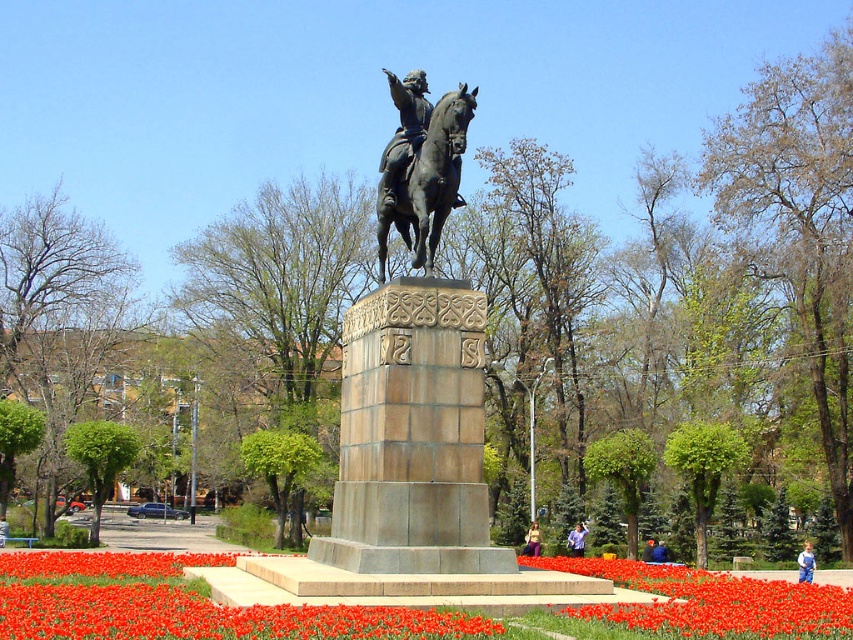
Question: Which of the following is the farthest from the observer?

Choices:
 (A) (444, 108)
 (B) (799, 580)

Answer: (B)

Question: Which point appears closest to the camera in this image?

Choices:
 (A) (804, 572)
 (B) (450, 205)
 (C) (724, 592)
 (D) (67, 636)

Answer: (D)

Question: Does vivid red petals at center appear on the left side of blue fabric shirt at center?

Choices:
 (A) no
 (B) yes

Answer: (B)

Question: Is red petal bed at center wider than blue fabric jacket at center?

Choices:
 (A) yes
 (B) no

Answer: (A)

Question: Which point is closer to the camera?

Choices:
 (A) (799, 572)
 (B) (395, 298)

Answer: (B)

Question: Can you confirm if purple fabric at center is positioned above blue fabric jacket at center?

Choices:
 (A) yes
 (B) no

Answer: (A)